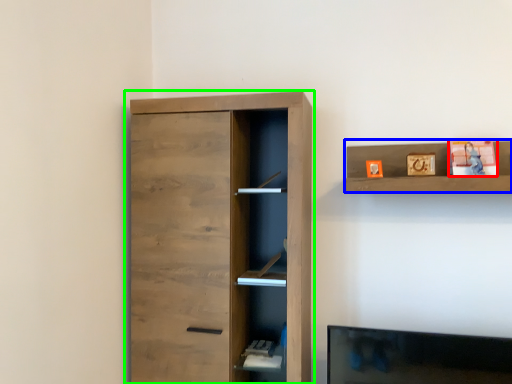
Question: Considering the real-world distances, which object is closest to toy (highlighted by a red box)? shelf (highlighted by a blue box) or cupboard (highlighted by a green box).

Choices:
 (A) shelf
 (B) cupboard

Answer: (A)